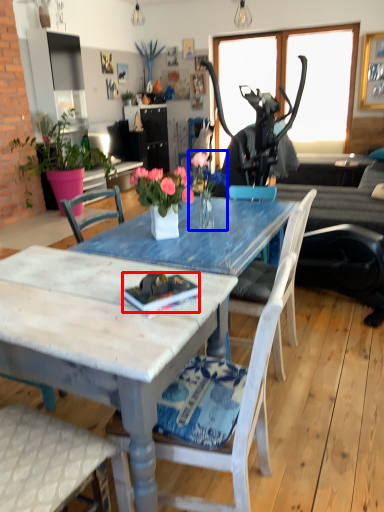
Question: Which object is further to the camera taking this photo, book (highlighted by a red box) or floral arrangement (highlighted by a blue box)?

Choices:
 (A) book
 (B) floral arrangement

Answer: (B)